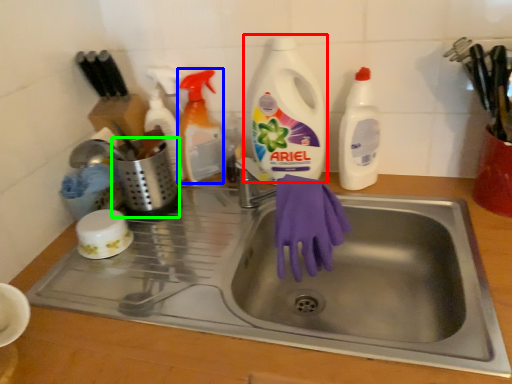
Question: Which is farther away from cleaning product (highlighted by a red box)? cleaning product (highlighted by a blue box) or appliance (highlighted by a green box)?

Choices:
 (A) cleaning product
 (B) appliance

Answer: (B)